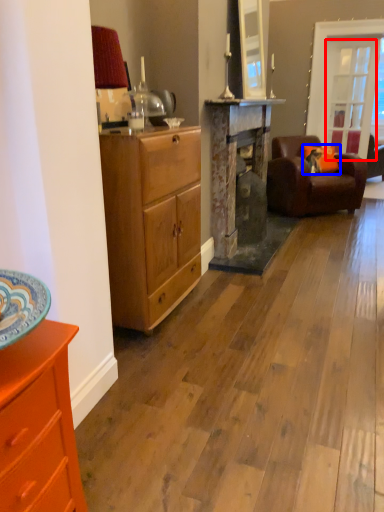
Question: Which point is further to the camera, glass door (highlighted by a red box) or pillow (highlighted by a blue box)?

Choices:
 (A) glass door
 (B) pillow

Answer: (A)